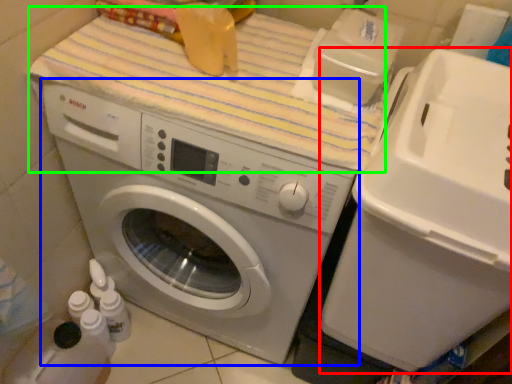
Question: Considering the real-world distances, which object is farthest from water cooler (highlighted by a red box)? washing machine (highlighted by a blue box) or bath towel (highlighted by a green box)?

Choices:
 (A) washing machine
 (B) bath towel

Answer: (B)